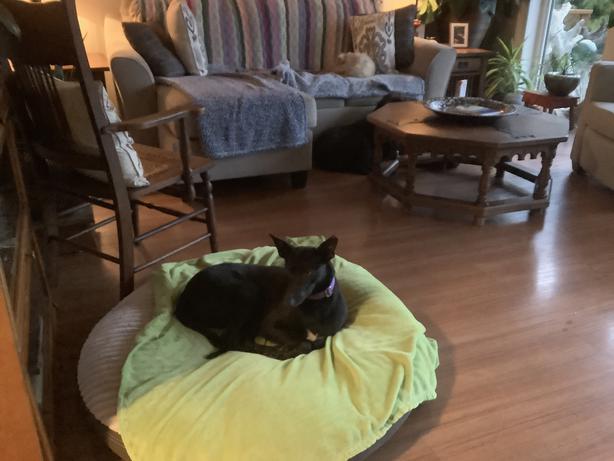
Where is `chair`? The image size is (614, 461). chair is located at coordinates (145, 187).